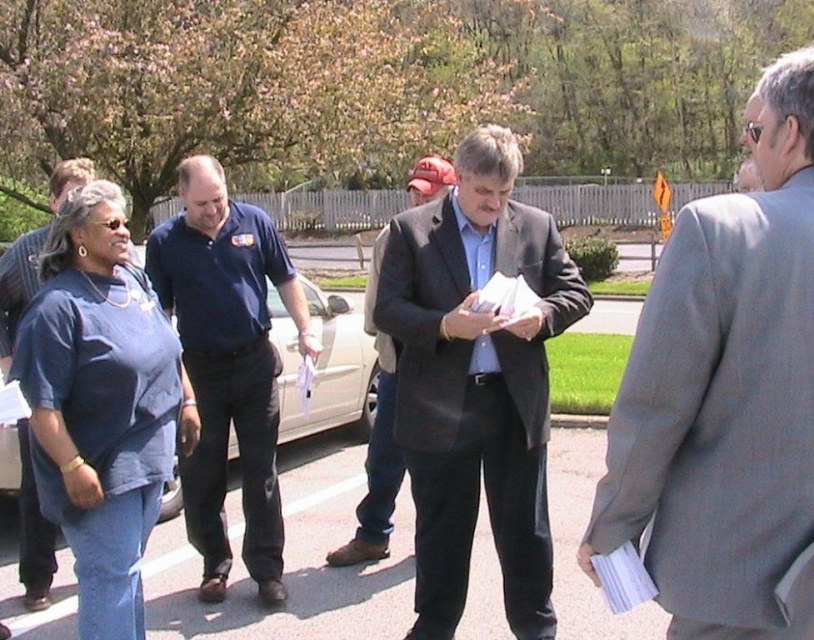
You are a fashion designer observing the image. You need to determine which item of clothing is shorter in height between the matte blue shirt at center and the dark gray wool coat at center. Which one is shorter?

The matte blue shirt at center is shorter in height compared to the dark gray wool coat at center.